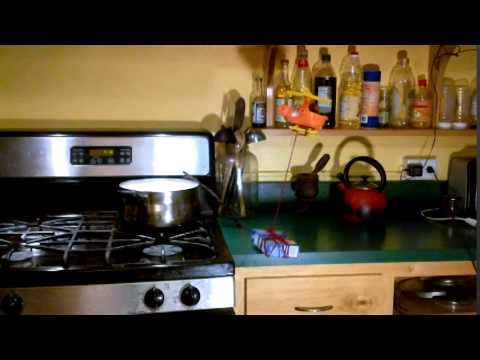
Where is `bottles`? bottles is located at coordinates (255, 96), (286, 76), (300, 72), (324, 83), (347, 73), (395, 79), (420, 92).